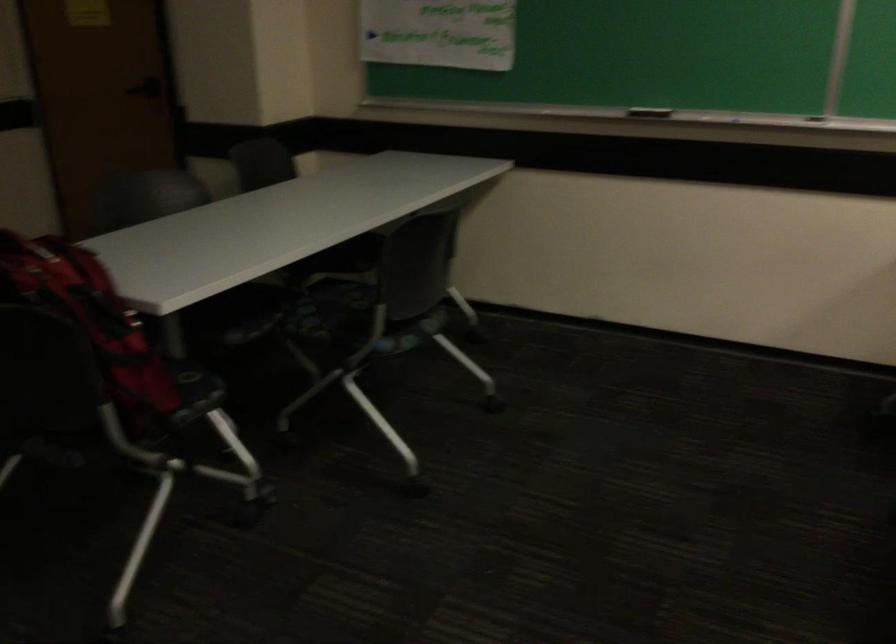
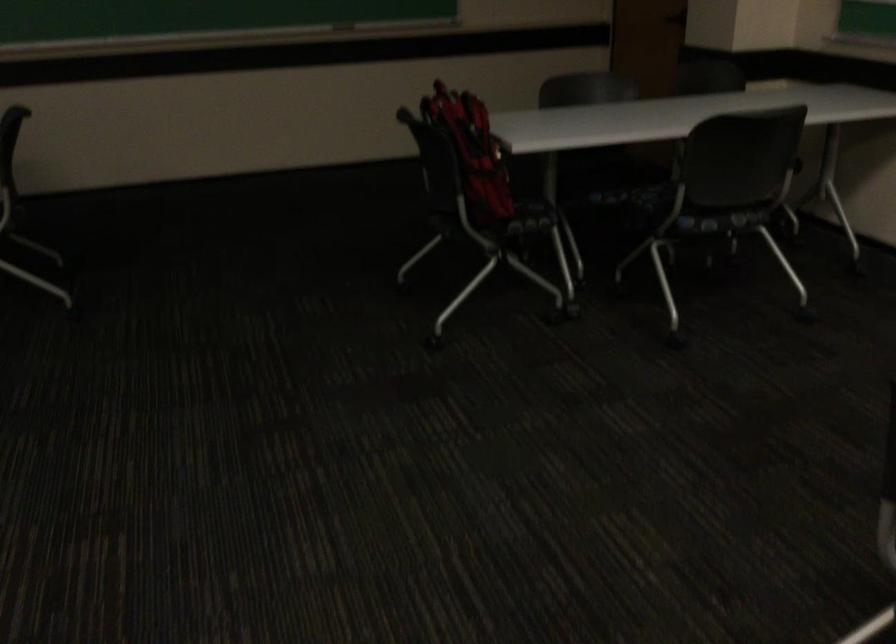
Locate, in the second image, the point that corresponds to point 245,319 in the first image.

(612, 180)